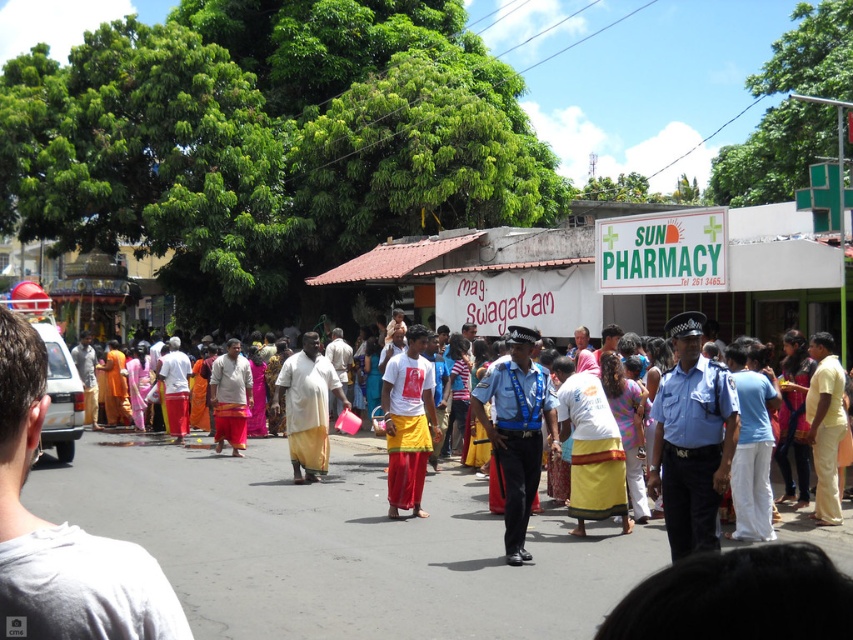
Does yellow cotton dress at center appear over white matte t-shirt at center?

Incorrect, yellow cotton dress at center is not positioned above white matte t-shirt at center.

Based on the photo, who is more forward, (315,552) or (434,433)?

Point (315,552) is more forward.

The image size is (853, 640). I want to click on yellow cotton dress at center, so click(x=316, y=513).

Does blue uniform at center appear under white matte t-shirt at center?

Actually, blue uniform at center is above white matte t-shirt at center.

Find the location of a particular element. blue uniform at center is located at coordinates (692, 440).

Who is more distant from viewer, (728, 445) or (424, 406)?

Positioned behind is point (424, 406).

Where is `blue uniform at center`? This screenshot has width=853, height=640. blue uniform at center is located at coordinates (692, 440).

Which of these two, yellow cotton dress at center or blue uniform at center, stands taller?

blue uniform at center

Can you confirm if yellow cotton dress at center is positioned below blue uniform at center?

Indeed, yellow cotton dress at center is positioned under blue uniform at center.

Which is behind, point (178, 524) or point (660, 449)?

Positioned behind is point (178, 524).

Where is `yellow cotton dress at center`? The height and width of the screenshot is (640, 853). yellow cotton dress at center is located at coordinates (316, 513).